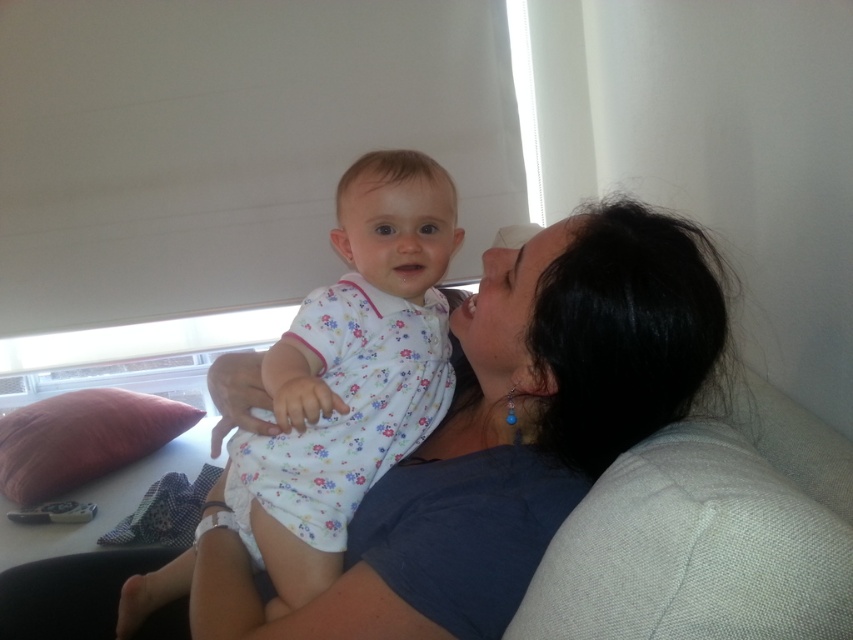
You are a photographer setting up for a family photo. You notice the blue fabric at upper center and the pink fabric pillow at left in the scene. Which fabric should you adjust to ensure both are centered in the frame?

The pink fabric pillow at left should be moved to the right to align with the blue fabric at upper center, as the blue fabric at upper center is currently positioned to the right of the pink fabric pillow at left.

Based on the photo, you are an interior designer planning to place a small decorative item on the sofa in the living room scene. The blue fabric at upper center is already placed at point (508, 433). Where should you place the new item to ensure it doesn not overlap with the existing blue fabric?

The blue fabric at upper center is located at point (508, 433). To avoid overlapping, place the new item at a different coordinate, such as point 0.3, 0.4.

You are a parent holding a baby wearing the white floral dress at center and want to place them on the pink fabric pillow at left. Given that the baby is 2 feet tall, will they fit comfortably on the pillow?

The distance between the white floral dress at center and pink fabric pillow at left is 3.81 feet. Since the baby is 2 feet tall, they will fit comfortably on the pillow as the distance allows enough space for placement.